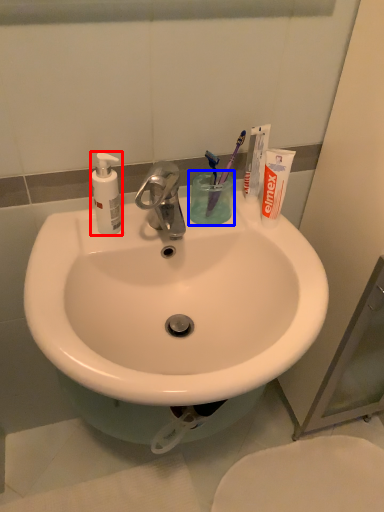
Question: Among these objects, which one is nearest to the camera, soap dispenser (highlighted by a red box) or liquid (highlighted by a blue box)?

Choices:
 (A) soap dispenser
 (B) liquid

Answer: (A)